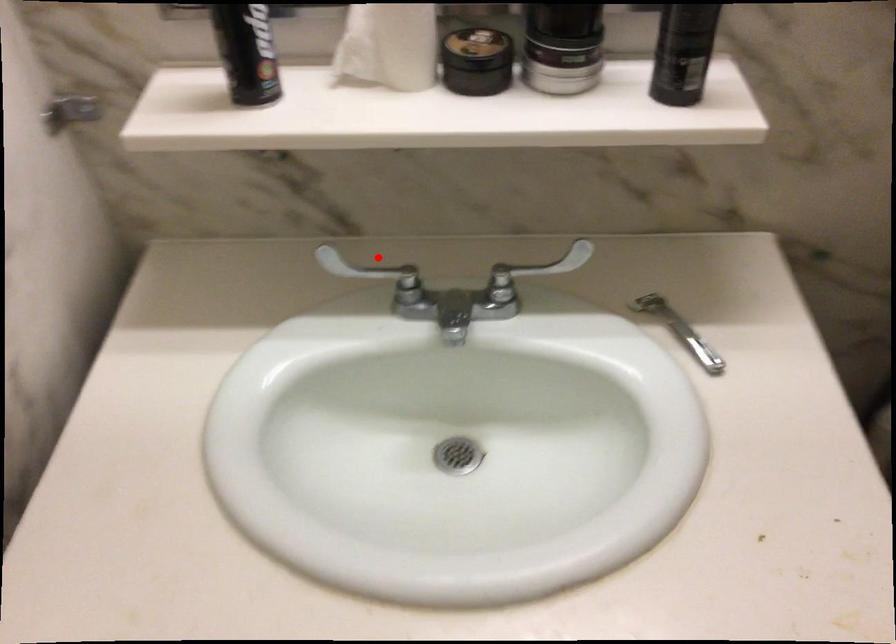
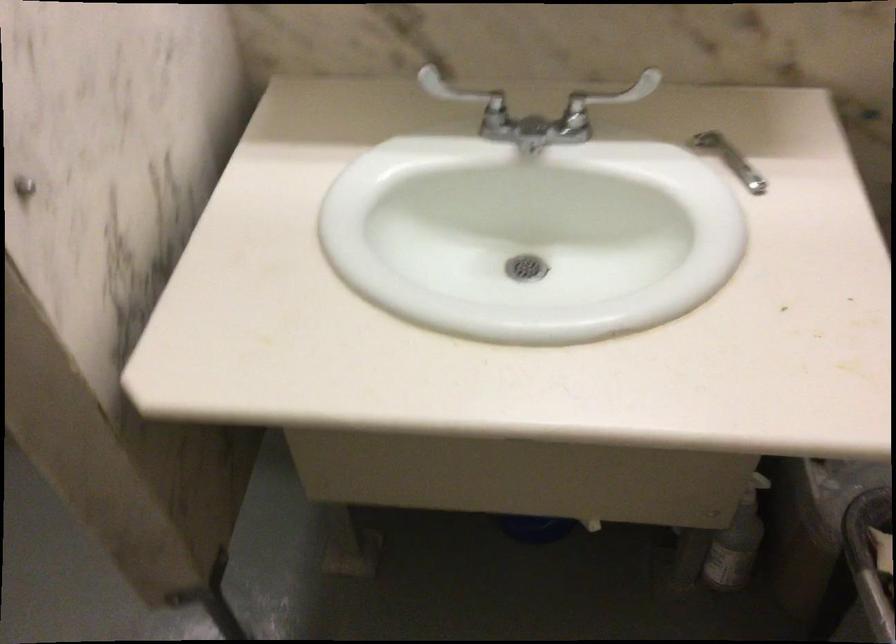
Question: A red point is marked in image1. In image2, is the corresponding 3D point closer to the camera or farther? Reply with the corresponding letter.

Choices:
 (A) The corresponding 3D point is closer.
 (B) The corresponding 3D point is farther.

Answer: (B)